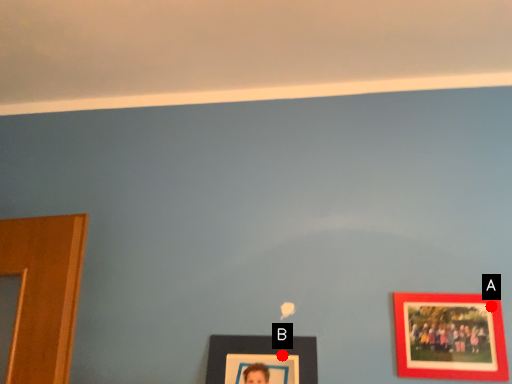
Question: Two points are circled on the image, labeled by A and B beside each circle. Which point appears closest to the camera in this image?

Choices:
 (A) A is closer
 (B) B is closer

Answer: (A)